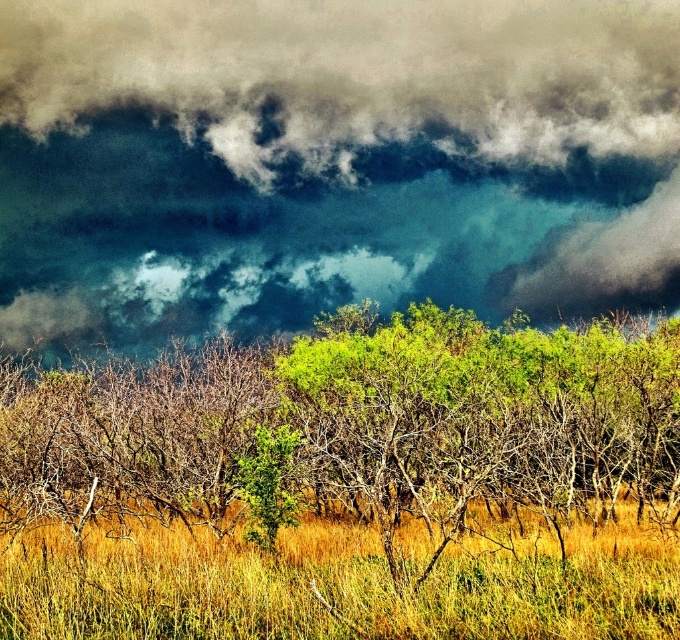
Based on the photo, who is taller, dark cloud at upper center or yellow grassy at center?

dark cloud at upper center

Which is above, dark cloud at upper center or yellow grassy at center?

dark cloud at upper center is higher up.

Is point (607, 195) positioned in front of point (430, 598)?

That is False.

Image resolution: width=680 pixels, height=640 pixels. What are the coordinates of `dark cloud at upper center` in the screenshot? It's located at (330, 160).

Is point (71, 236) positioned after point (503, 380)?

Yes, it is behind point (503, 380).

At what (x,y) coordinates should I click in order to perform the action: click on dark cloud at upper center. Please return your answer as a coordinate pair (x, y). Looking at the image, I should click on (330, 160).

Where is `dark cloud at upper center`? dark cloud at upper center is located at coordinates (330, 160).

Can you confirm if green leafy tree at center is positioned to the right of yellow grassy at center?

No, green leafy tree at center is not to the right of yellow grassy at center.

Is green leafy tree at center smaller than yellow grassy at center?

No.

Identify the location of green leafy tree at center. This screenshot has width=680, height=640. (354, 428).